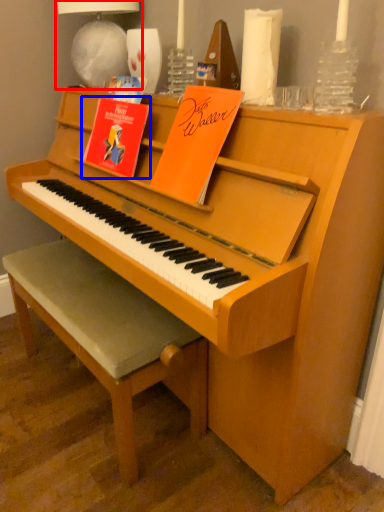
Question: Among these objects, which one is nearest to the camera, lamp (highlighted by a red box) or paperback book (highlighted by a blue box)?

Choices:
 (A) lamp
 (B) paperback book

Answer: (B)